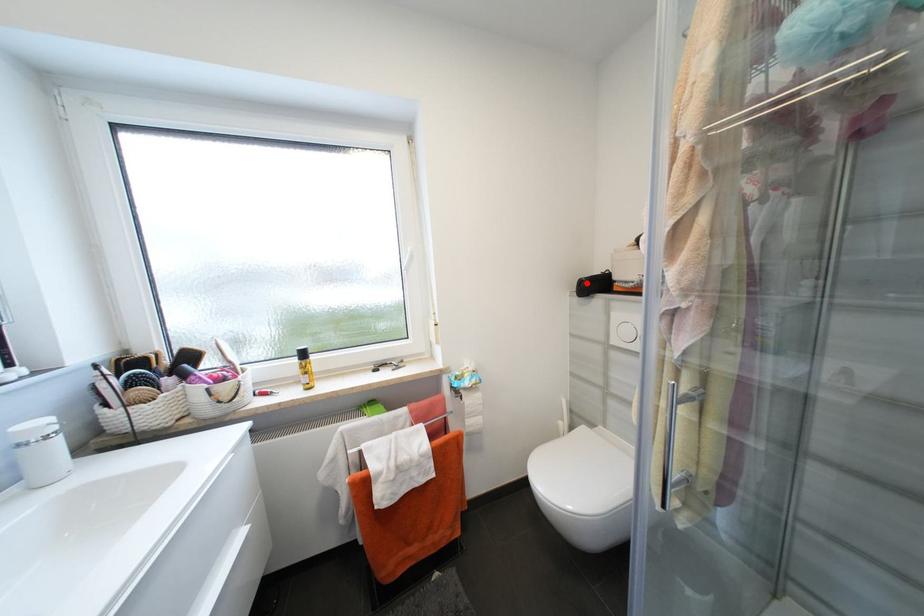
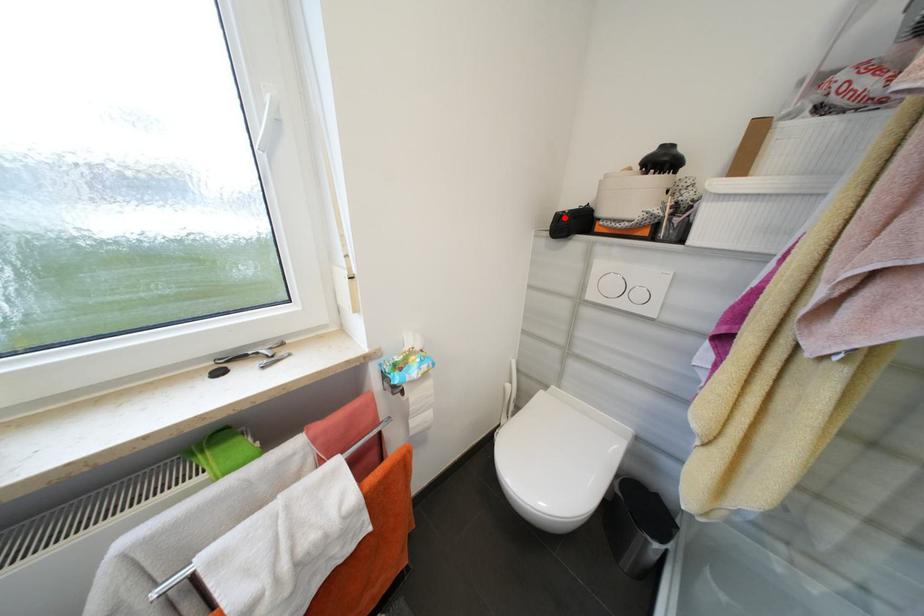
I am providing you with two images of the same scene from different viewpoints. A red point is marked on the first image and another point is marked on the second image. Do the highlighted points in image1 and image2 indicate the same real-world spot?

Yes